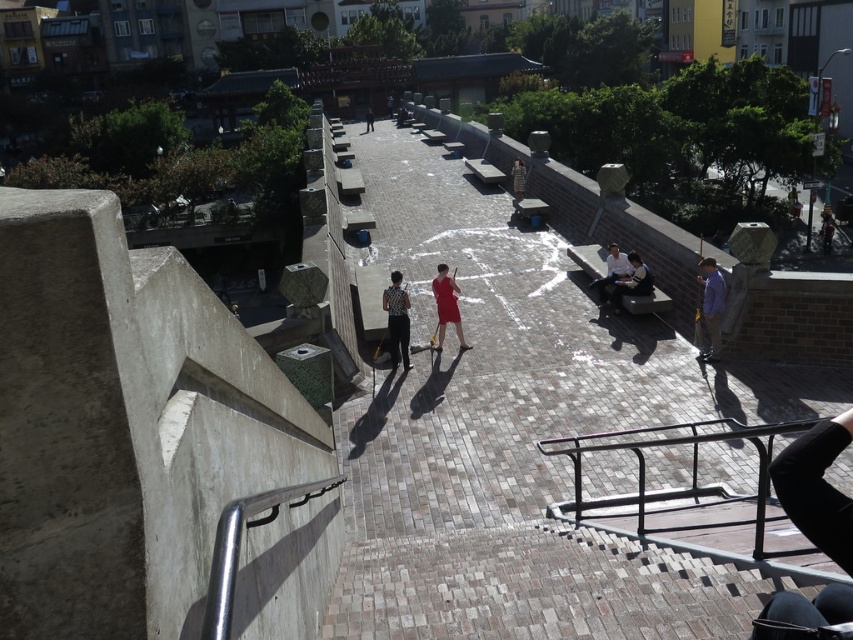
Question: Which of the following is the closest to the observer?

Choices:
 (A) (614, 296)
 (B) (738, 438)
 (C) (456, 298)
 (D) (705, 356)

Answer: (B)

Question: In this image, where is black leather pants at lower right located relative to striped fabric dress at center?

Choices:
 (A) right
 (B) left

Answer: (B)

Question: Among these points, which one is farthest from the camera?

Choices:
 (A) (650, 284)
 (B) (454, 326)
 (C) (822, 620)

Answer: (B)

Question: Which point is farther to the camera?

Choices:
 (A) silver metallic handrail at lower left
 (B) blue fabric shirt at right

Answer: (B)

Question: Does matte red dress at center appear on the right side of dark gray suit at center?

Choices:
 (A) no
 (B) yes

Answer: (A)

Question: Does black leather pants at lower right have a larger size compared to dark gray suit at center?

Choices:
 (A) no
 (B) yes

Answer: (A)